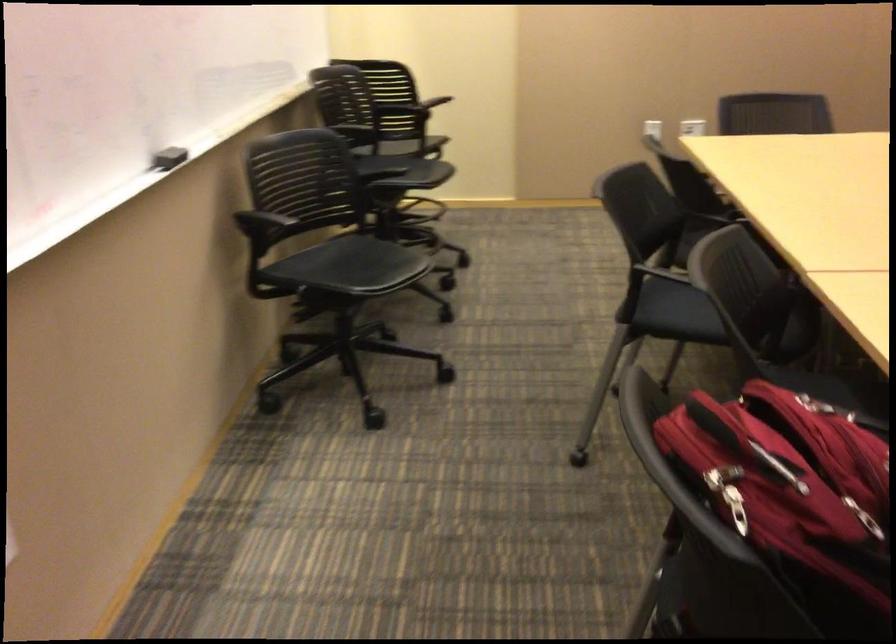
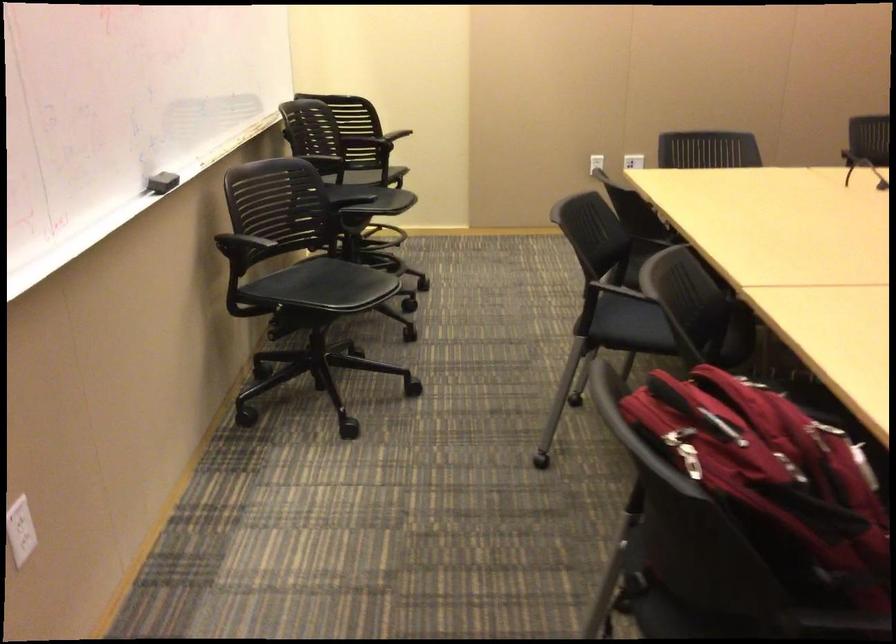
Find the pixel in the second image that matches point (166, 160) in the first image.

(161, 182)